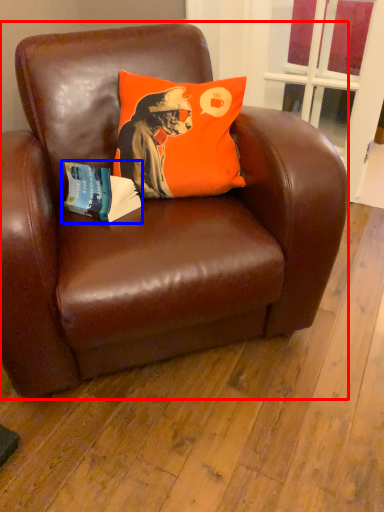
Question: Among these objects, which one is nearest to the camera, chair (highlighted by a red box) or paperback book (highlighted by a blue box)?

Choices:
 (A) chair
 (B) paperback book

Answer: (A)